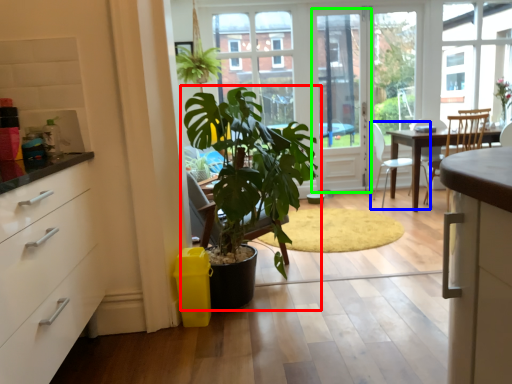
Question: Based on their relative distances, which object is farther from houseplant (highlighted by a red box)? Choose from chair (highlighted by a blue box) and screen door (highlighted by a green box).

Choices:
 (A) chair
 (B) screen door

Answer: (A)